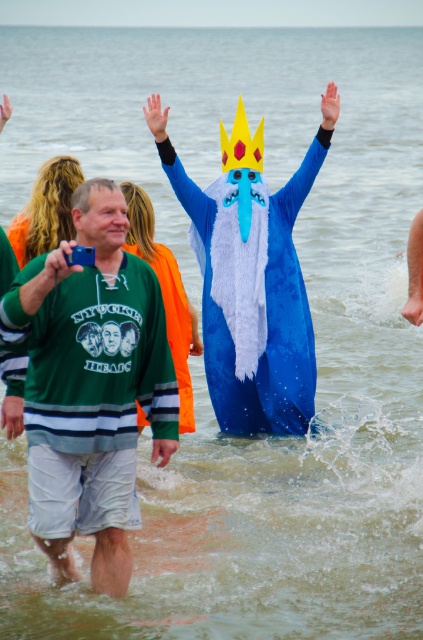
Question: Which is farther from the fuzzy blue costume at center?

Choices:
 (A) green jersey at center
 (B) yellow paper crown at center

Answer: (A)

Question: Estimate the real-world distances between objects in this image. Which object is closer to the green jersey at center?

Choices:
 (A) yellow paper crown at center
 (B) fuzzy blue costume at center
 (C) blue plush costume at center

Answer: (B)

Question: Which of the following is the closest to the observer?

Choices:
 (A) (294, 301)
 (B) (104, 289)
 (C) (164, 256)

Answer: (B)

Question: Is green jersey at center smaller than fuzzy blue costume at center?

Choices:
 (A) no
 (B) yes

Answer: (A)

Question: From the image, what is the correct spatial relationship of green jersey at center in relation to yellow paper crown at center?

Choices:
 (A) right
 (B) left

Answer: (B)

Question: Can you confirm if green jersey at center is wider than blue plush costume at center?

Choices:
 (A) yes
 (B) no

Answer: (B)